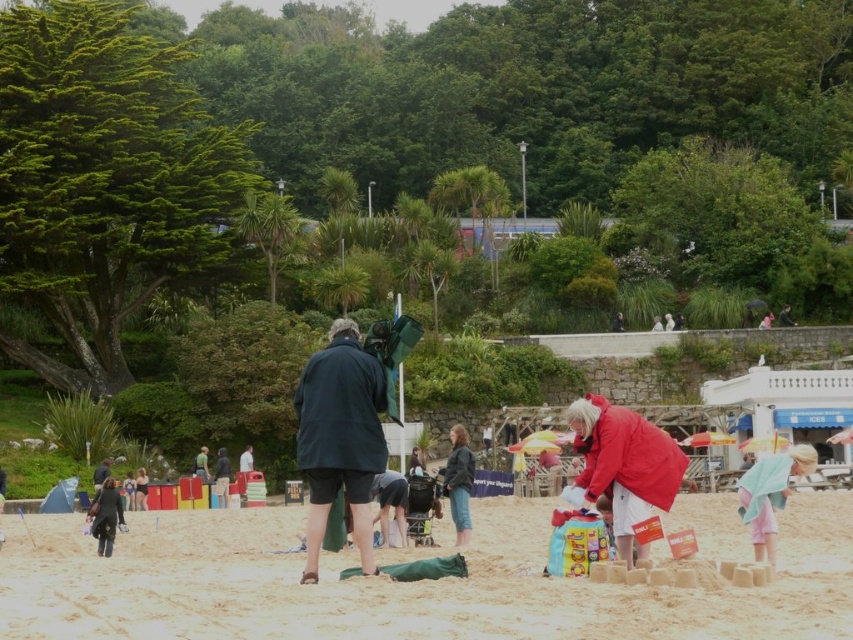
You are a photographer trying to capture a shot of the dark green fabric at center and the leather jacket at center. Which object is covering part of the other?

The dark green fabric at center is positioned over the leather jacket at center, so it is covering part of the leather jacket at center.

You are a photographer trying to capture the beige sandcastle at center without the dark gray fabric bag at lower left appearing in the shot. Is this possible given their positions?

The beige sandcastle at center is positioned over the dark gray fabric bag at lower left, so the bag will be visible underneath the sandcastle in the photo. To avoid the bag, you would need to adjust your angle or move the sandcastle.

Based on the photo, you are a photographer trying to capture both the dark green fabric at center and the red matte jacket at center in a single frame. Which object should you focus on first to ensure both are in the frame without moving the camera?

You should focus on the red matte jacket at center first because it is larger than the dark green fabric at center, allowing you to frame it first and ensure the smaller dark green fabric at center fits within the same shot.